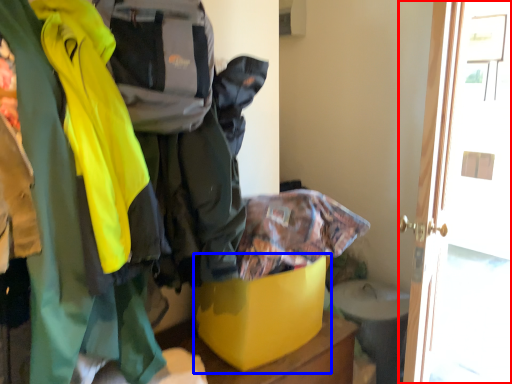
Question: Which of the following is the farthest to the observer, door (highlighted by a red box) or storage box (highlighted by a blue box)?

Choices:
 (A) door
 (B) storage box

Answer: (A)